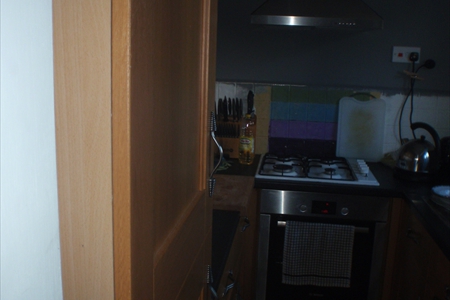
This screenshot has width=450, height=300. Identify the location of silver teakettle. (420, 159).